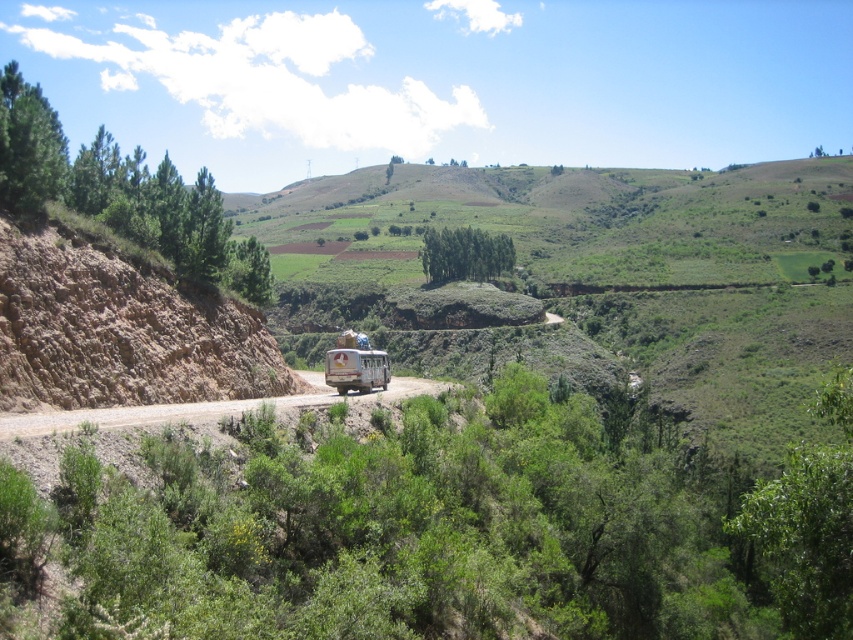
You are a photographer planning to capture a landscape shot of the brown dirt at left and the rusty metal bus at center. Which object occupies a larger portion of the image horizontally?

The brown dirt at left occupies a larger portion of the image horizontally since its width surpasses that of the rusty metal bus at center.

You are a hiker standing on the brown dirt at left and want to reach the rusty metal bus at center. Which direction should you move to get closer to the bus?

You should move downward towards the rusty metal bus at center since the brown dirt at left is above it.